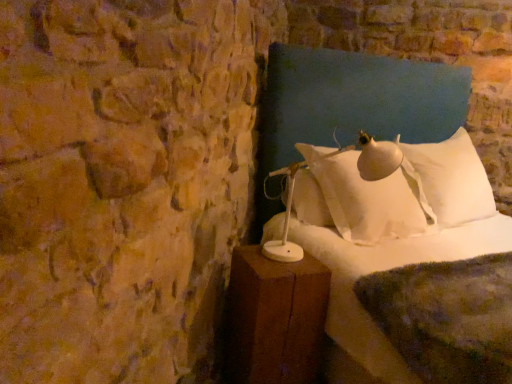
Question: Considering the positions of point (245, 274) and point (364, 225), is point (245, 274) closer or farther from the camera than point (364, 225)?

Choices:
 (A) closer
 (B) farther

Answer: (A)

Question: From a real-world perspective, is brown wooden nightstand at lower right above or below white soft pillow at upper right?

Choices:
 (A) below
 (B) above

Answer: (A)

Question: Which is farther from the brown wooden nightstand at lower right?

Choices:
 (A) white soft pillow at upper right
 (B) white soft bed at center

Answer: (A)

Question: Estimate the real-world distances between objects in this image. Which object is closer to the brown wooden nightstand at lower right?

Choices:
 (A) white soft bed at center
 (B) white soft pillow at upper right

Answer: (A)